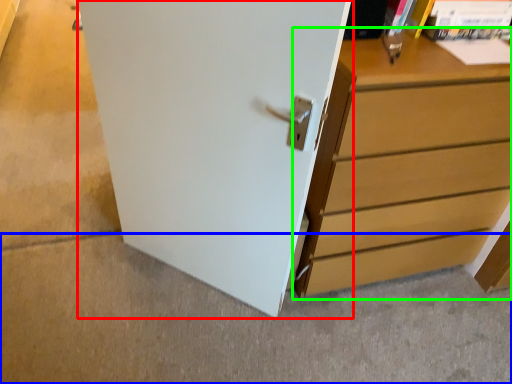
Question: Considering the real-world distances, which object is closest to door (highlighted by a red box)? concrete (highlighted by a blue box) or chest of drawers (highlighted by a green box).

Choices:
 (A) concrete
 (B) chest of drawers

Answer: (B)